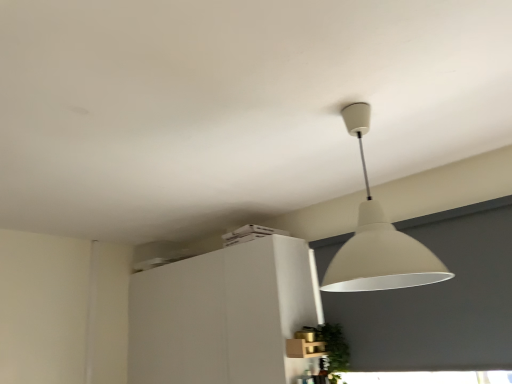
Question: Should I look upward or downward to see green leafy plant at lower right?

Choices:
 (A) down
 (B) up

Answer: (A)

Question: Is matte white lampshade at upper center positioned far away from white matte cabinet at upper center?

Choices:
 (A) yes
 (B) no

Answer: (A)

Question: From a real-world perspective, is matte white lampshade at upper center over white matte cabinet at upper center?

Choices:
 (A) yes
 (B) no

Answer: (A)

Question: Could white matte cabinet at upper center be considered to be inside matte white lampshade at upper center?

Choices:
 (A) yes
 (B) no

Answer: (B)

Question: Can you confirm if matte white lampshade at upper center is bigger than white matte cabinet at upper center?

Choices:
 (A) yes
 (B) no

Answer: (B)

Question: Does matte white lampshade at upper center have a lesser width compared to white matte cabinet at upper center?

Choices:
 (A) yes
 (B) no

Answer: (B)

Question: From the image's perspective, is matte white lampshade at upper center below white matte cabinet at upper center?

Choices:
 (A) no
 (B) yes

Answer: (A)

Question: Is there a large distance between white matte cabinet at upper center and green leafy plant at lower right?

Choices:
 (A) yes
 (B) no

Answer: (B)

Question: Considering the relative sizes of white matte cabinet at upper center and green leafy plant at lower right in the image provided, is white matte cabinet at upper center thinner than green leafy plant at lower right?

Choices:
 (A) yes
 (B) no

Answer: (B)

Question: From the image's perspective, does white matte cabinet at upper center appear higher than green leafy plant at lower right?

Choices:
 (A) no
 (B) yes

Answer: (A)

Question: Is white matte cabinet at upper center turned away from green leafy plant at lower right?

Choices:
 (A) yes
 (B) no

Answer: (B)

Question: Is white matte cabinet at upper center facing towards green leafy plant at lower right?

Choices:
 (A) no
 (B) yes

Answer: (A)

Question: Does white matte cabinet at upper center touch green leafy plant at lower right?

Choices:
 (A) no
 (B) yes

Answer: (A)

Question: Is green leafy plant at lower right taller than matte white lampshade at upper center?

Choices:
 (A) yes
 (B) no

Answer: (B)